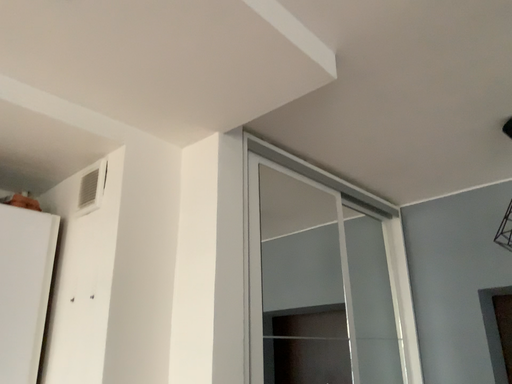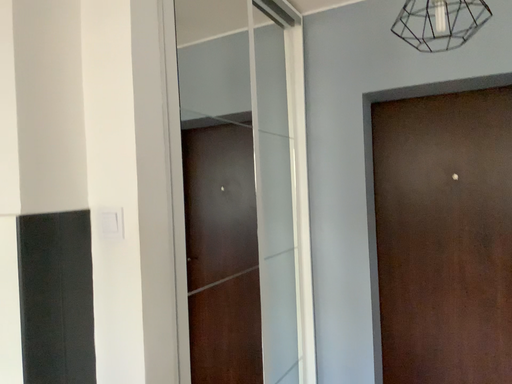
Question: How did the camera likely rotate when shooting the video?

Choices:
 (A) rotated upward
 (B) rotated downward

Answer: (B)